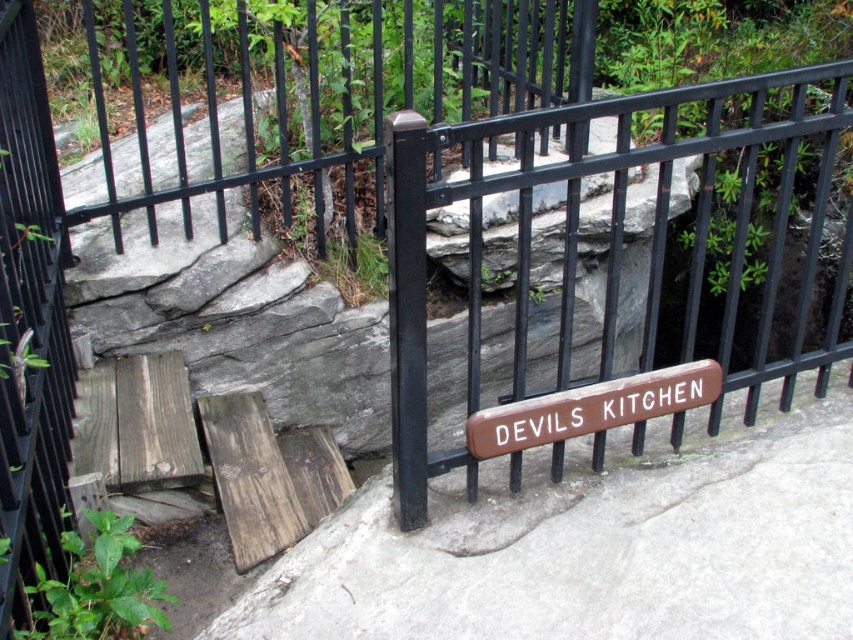
Question: Where is white concrete pavement at lower center located in relation to brown wooden sign at center in the image?

Choices:
 (A) left
 (B) right

Answer: (B)

Question: Which point is farther from the camera taking this photo?

Choices:
 (A) (0, 458)
 (B) (482, 458)
 (C) (689, 442)

Answer: (C)

Question: From the image, what is the correct spatial relationship of wooden sign at center in relation to brown wooden sign at center?

Choices:
 (A) left
 (B) right

Answer: (A)

Question: Which of these objects is positioned closest to the white concrete pavement at lower center?

Choices:
 (A) brown wooden sign at center
 (B) wooden sign at center

Answer: (A)

Question: Observing the image, what is the correct spatial positioning of white concrete pavement at lower center in reference to brown wooden sign at center?

Choices:
 (A) right
 (B) left

Answer: (A)

Question: Which of the following is the closest to the observer?

Choices:
 (A) (573, 420)
 (B) (65, 576)
 (C) (500, 628)

Answer: (C)